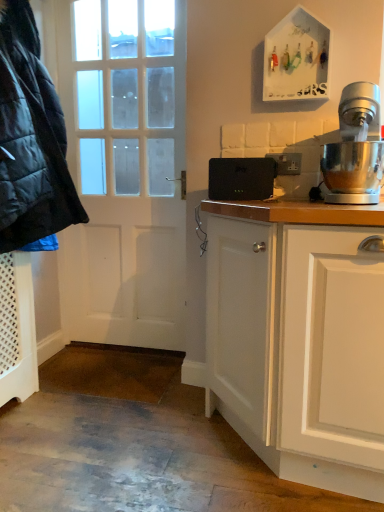
Question: Can you confirm if black plastic router at center is taller than white matte door at left?

Choices:
 (A) no
 (B) yes

Answer: (A)

Question: From a real-world perspective, is black plastic router at center located higher than white matte door at left?

Choices:
 (A) no
 (B) yes

Answer: (B)

Question: Considering the relative positions of black plastic router at center and white matte door at left in the image provided, is black plastic router at center to the right of white matte door at left from the viewer's perspective?

Choices:
 (A) yes
 (B) no

Answer: (A)

Question: Is the position of black plastic router at center more distant than that of white matte door at left?

Choices:
 (A) yes
 (B) no

Answer: (B)

Question: Could you tell me if black plastic router at center is facing white matte door at left?

Choices:
 (A) no
 (B) yes

Answer: (A)

Question: From a real-world perspective, is black plastic router at center physically below white matte door at left?

Choices:
 (A) yes
 (B) no

Answer: (B)

Question: Does black plastic router at center have a lesser height compared to polished stainless steel stand mixer at right?

Choices:
 (A) yes
 (B) no

Answer: (A)

Question: Does black plastic router at center turn towards polished stainless steel stand mixer at right?

Choices:
 (A) no
 (B) yes

Answer: (A)

Question: Considering the relative sizes of black plastic router at center and polished stainless steel stand mixer at right in the image provided, is black plastic router at center thinner than polished stainless steel stand mixer at right?

Choices:
 (A) yes
 (B) no

Answer: (A)

Question: Is black plastic router at center completely or partially outside of polished stainless steel stand mixer at right?

Choices:
 (A) no
 (B) yes

Answer: (B)

Question: Is black plastic router at center wider than polished stainless steel stand mixer at right?

Choices:
 (A) no
 (B) yes

Answer: (A)

Question: From the image's perspective, is black plastic router at center below polished stainless steel stand mixer at right?

Choices:
 (A) no
 (B) yes

Answer: (B)

Question: Can we say matte black jacket at left lies outside white matte door at left?

Choices:
 (A) yes
 (B) no

Answer: (A)